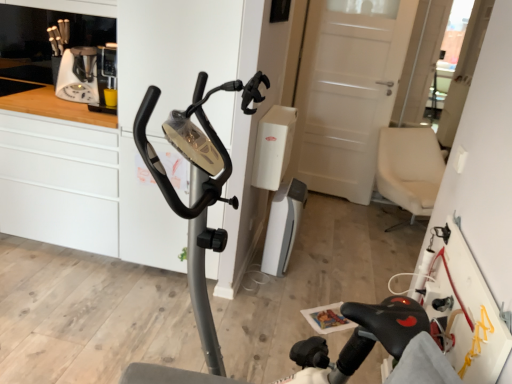
Question: From a real-world perspective, is white plastic vacuum cleaner at center physically located above or below metallic gray stationary bicycle at center?

Choices:
 (A) above
 (B) below

Answer: (B)

Question: Looking at the image, does white plastic vacuum cleaner at center seem bigger or smaller compared to metallic gray stationary bicycle at center?

Choices:
 (A) small
 (B) big

Answer: (A)

Question: Which object is positioned closest to the white matte cabinet at left?

Choices:
 (A) white plastic coffee machine at upper left
 (B) white glossy dresser at center
 (C) white plastic vacuum cleaner at center
 (D) metallic gray stationary bicycle at center

Answer: (B)

Question: Which is farther from the white matte cabinet at left?

Choices:
 (A) metallic gray stationary bicycle at center
 (B) white glossy dresser at center
 (C) white plastic vacuum cleaner at center
 (D) white plastic coffee machine at upper left

Answer: (A)